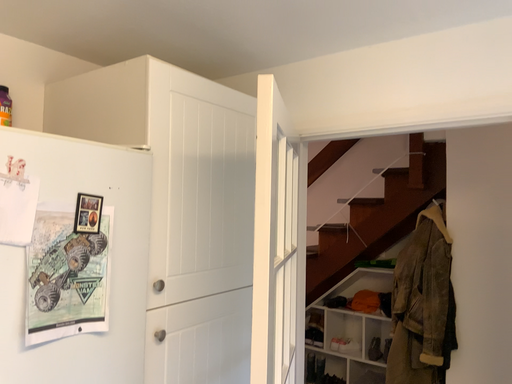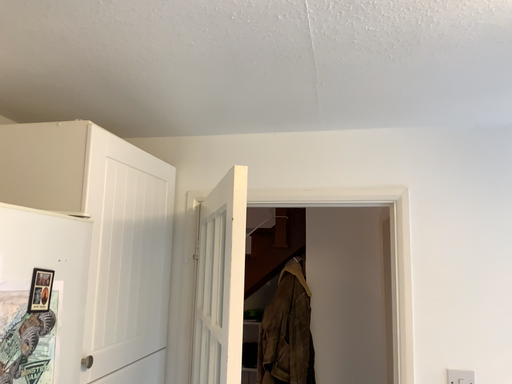
Question: Which way did the camera rotate in the video?

Choices:
 (A) rotated left
 (B) rotated right

Answer: (B)